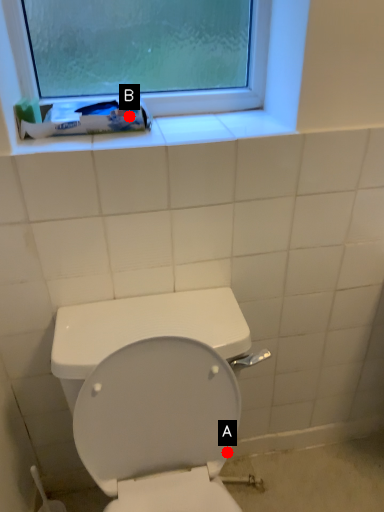
Question: Two points are circled on the image, labeled by A and B beside each circle. Which point appears farthest from the camera in this image?

Choices:
 (A) A is further
 (B) B is further

Answer: (A)